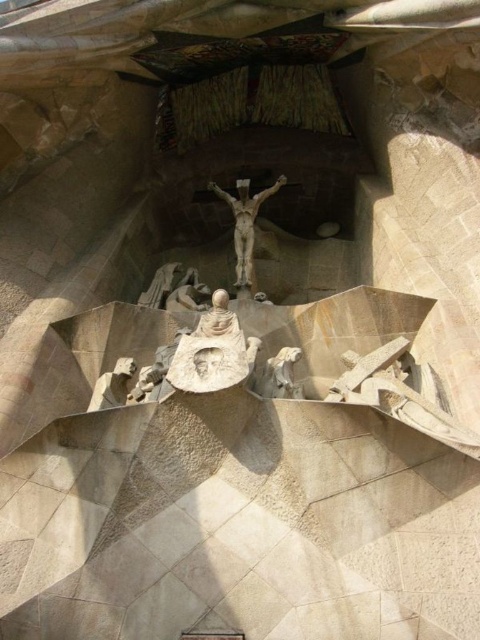
Identify the location of polished bronze crucifix at center. The height and width of the screenshot is (640, 480). (244, 224).

Is polished bronze crucifix at center smaller than dark gray stone statue at center?

Actually, polished bronze crucifix at center might be larger than dark gray stone statue at center.

The height and width of the screenshot is (640, 480). Describe the element at coordinates (244, 224) in the screenshot. I see `polished bronze crucifix at center` at that location.

Image resolution: width=480 pixels, height=640 pixels. I want to click on polished bronze crucifix at center, so click(244, 224).

Is polished bronze crucifix at center above white marble statue at center?

Yes, polished bronze crucifix at center is above white marble statue at center.

Between polished bronze crucifix at center and white marble statue at center, which one is positioned lower?

white marble statue at center is below.

Is point (222, 198) positioned in front of point (202, 356)?

No, (222, 198) is further to viewer.

What are the coordinates of `polished bronze crucifix at center` in the screenshot? It's located at (244, 224).

How distant is carved stone angel at center from white marble statue at center?

carved stone angel at center and white marble statue at center are 10.21 meters apart.

Image resolution: width=480 pixels, height=640 pixels. Find the location of `carved stone angel at center`. carved stone angel at center is located at coordinates (280, 374).

Is point (273, 362) more distant than point (206, 364)?

Yes, point (273, 362) is farther from viewer.

The height and width of the screenshot is (640, 480). Find the location of `carved stone angel at center`. carved stone angel at center is located at coordinates (280, 374).